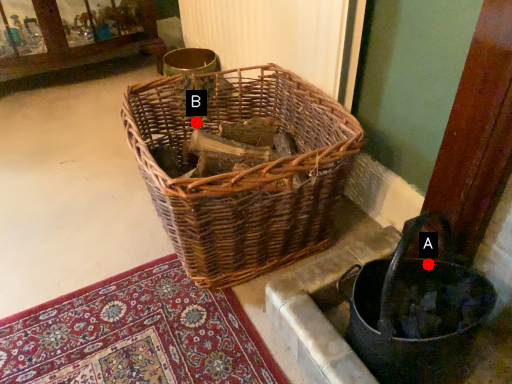
Question: Two points are circled on the image, labeled by A and B beside each circle. Which point is further to the camera?

Choices:
 (A) A is further
 (B) B is further

Answer: (B)